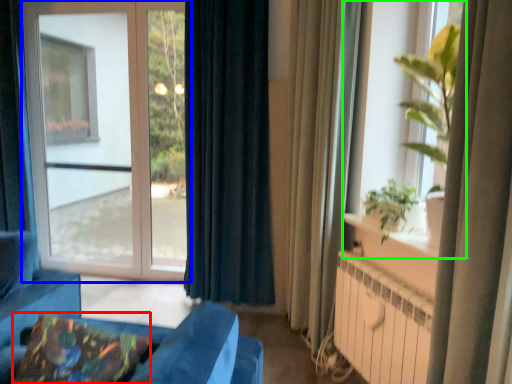
Question: Considering the real-world distances, which object is closest to pillow (highlighted by a red box)? window (highlighted by a blue box) or window (highlighted by a green box).

Choices:
 (A) window
 (B) window

Answer: (B)